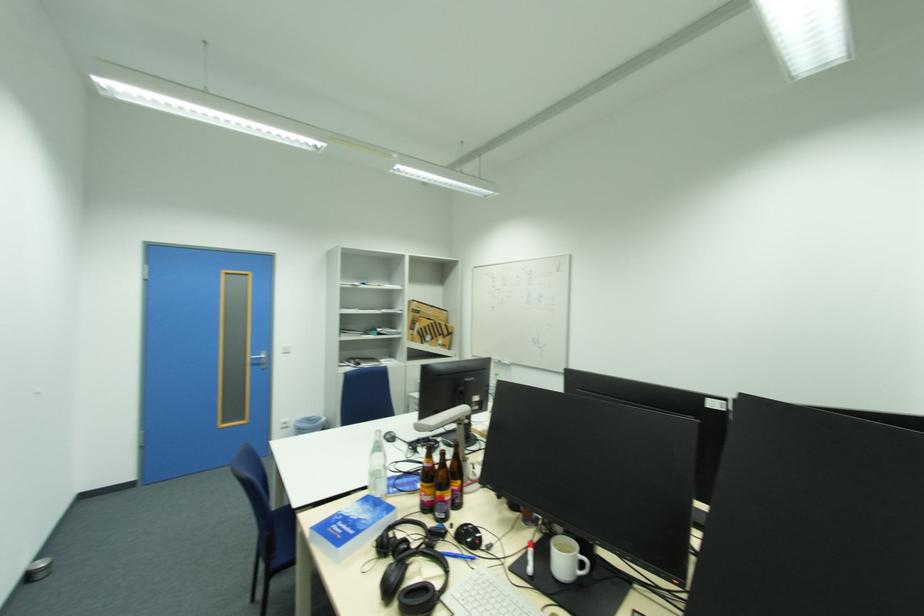
Find the location of `glass water bottle`. glass water bottle is located at coordinates (377, 467).